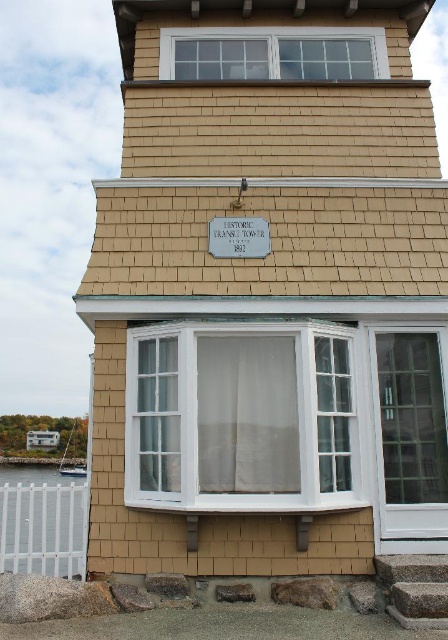
You are standing in front of the building and want to take a photo of the white glass window at upper center without including the white plastic fence at lower left in the frame. Which direction should you move to achieve this?

Move to the left. The white glass window at upper center is to the right of the white plastic fence at lower left, so moving left would position the fence out of the frame while keeping the window centered.

You are standing directly in front of the building and want to take a photo of the white glass window at center. Based on its position, where should you aim your camera? Please provide the coordinates as a point in the format of a tuple with two decimal numbers, like this example format, but do not include any other text or explanation.

The white glass window at center is located at point coordinates of [241,417]. Therefore, you should aim your camera at the coordinates point of approximately [241,417] to capture the white glass window at center.

You are an architect inspecting the building facade. You notice two white glass windows. Which one is taller between the white glass window at center and the white glass window at upper center?

The white glass window at center is taller than the white glass window at upper center.